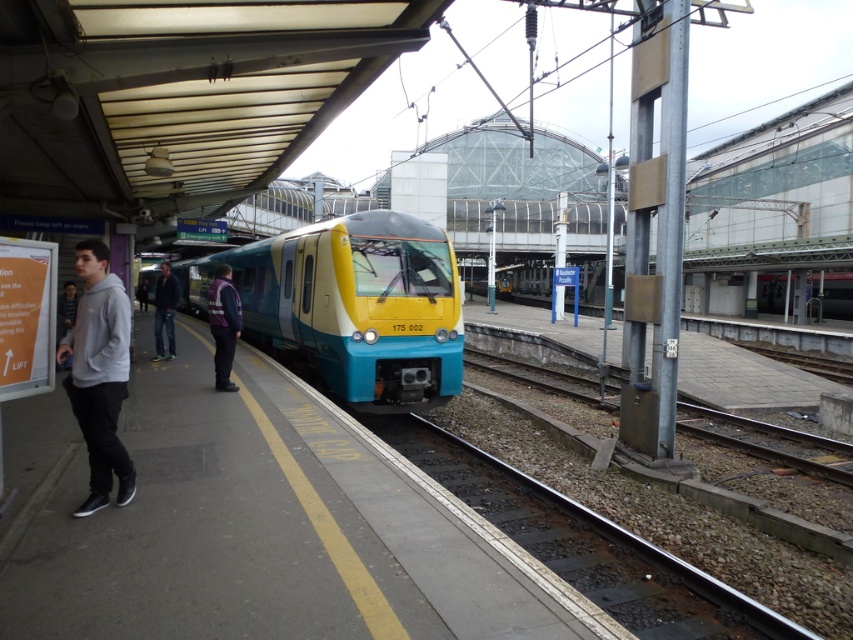
Is smooth metal train track at center below dark blue jeans at left?

Correct, smooth metal train track at center is located below dark blue jeans at left.

Can you confirm if smooth metal train track at center is wider than dark blue jeans at left?

No, smooth metal train track at center is not wider than dark blue jeans at left.

This screenshot has height=640, width=853. I want to click on smooth metal train track at center, so click(x=577, y=536).

In order to click on smooth metal train track at center in this screenshot , I will do `click(577, 536)`.

This screenshot has width=853, height=640. In order to click on smooth metal train track at center in this screenshot , I will do `click(577, 536)`.

Does point (555, 566) come in front of point (233, 289)?

Yes, point (555, 566) is closer to viewer.

Locate an element on the screen. smooth metal train track at center is located at coordinates (577, 536).

Between teal glossy train at center and reflective purple jacket at center, which one appears on the right side from the viewer's perspective?

Positioned to the right is reflective purple jacket at center.

Who is taller, teal glossy train at center or reflective purple jacket at center?

With more height is teal glossy train at center.

Is point (349, 360) farther from camera compared to point (207, 323)?

No, it is in front of (207, 323).

You are a GUI agent. You are given a task and a screenshot of the screen. Output one action in this format:
    pyautogui.click(x=<x>, y=<y>)
    Task: Click on the teal glossy train at center
    
    Given the screenshot: What is the action you would take?
    pyautogui.click(x=350, y=305)